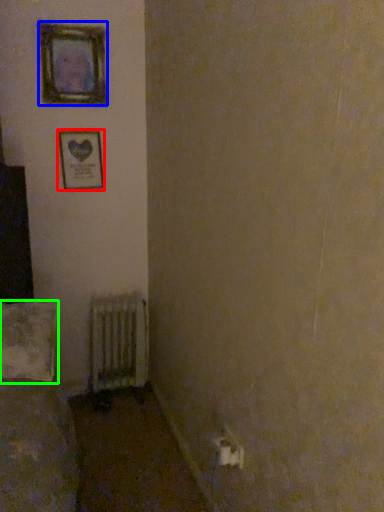
Question: Based on their relative distances, which object is farther from picture frame (highlighted by a red box)? Choose from picture frame (highlighted by a blue box) and pillow (highlighted by a green box).

Choices:
 (A) picture frame
 (B) pillow

Answer: (B)